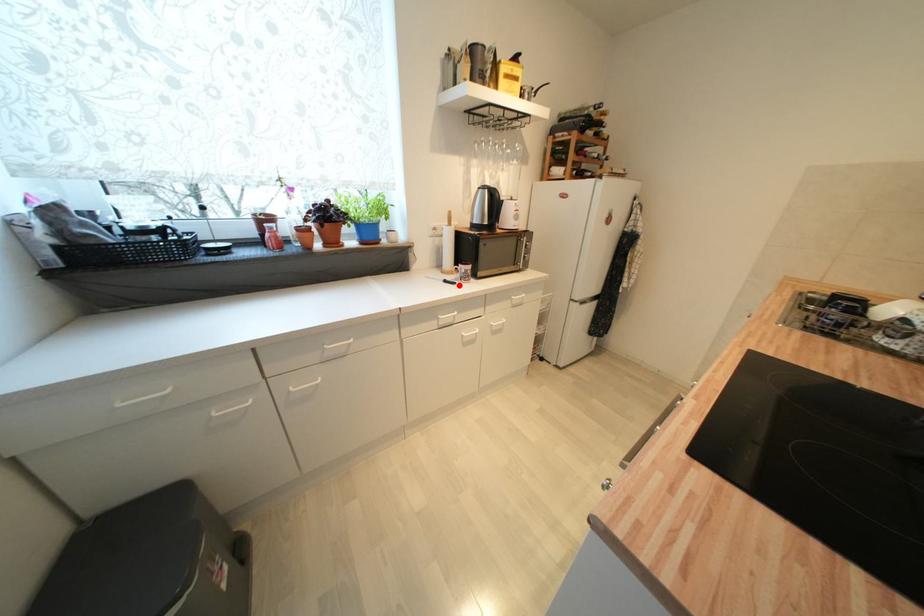
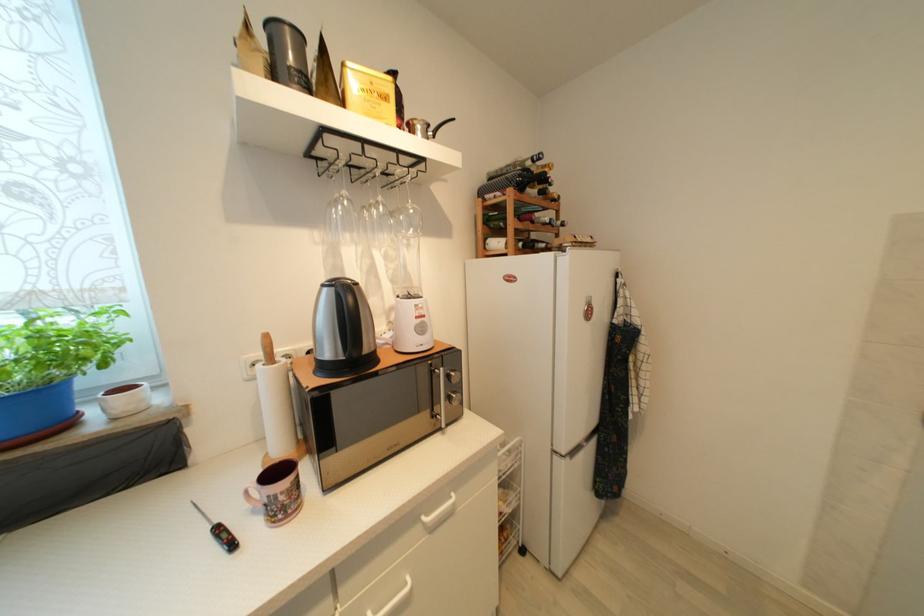
The point at the highlighted location is marked in the first image. Where is the corresponding point in the second image?

(237, 546)